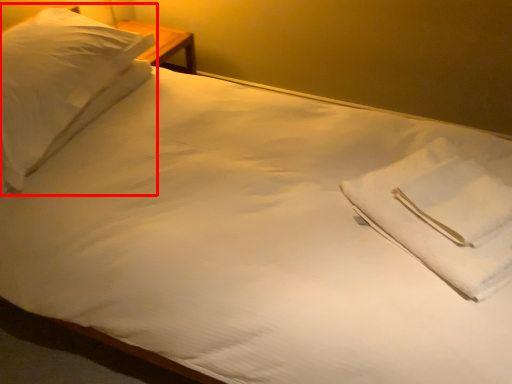
Question: From the image's perspective, what is the correct spatial positioning of pillow (annotated by the red box) in reference to cloth?

Choices:
 (A) above
 (B) below

Answer: (A)